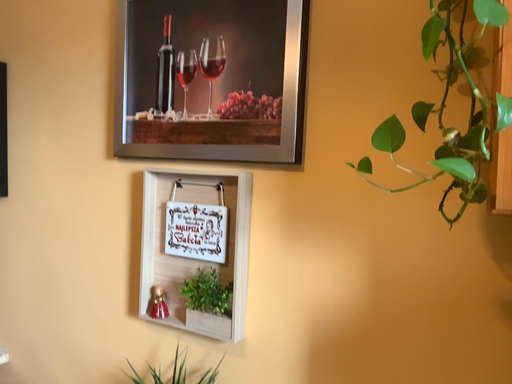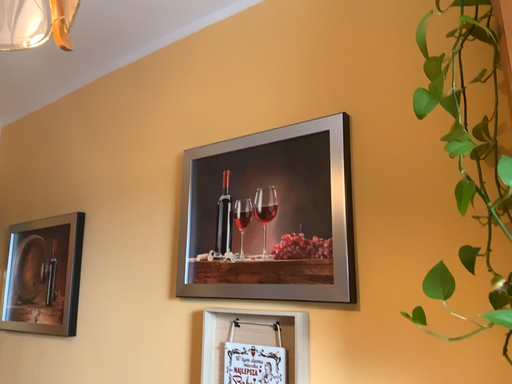
Question: Which way did the camera rotate in the video?

Choices:
 (A) rotated right
 (B) rotated left

Answer: (B)